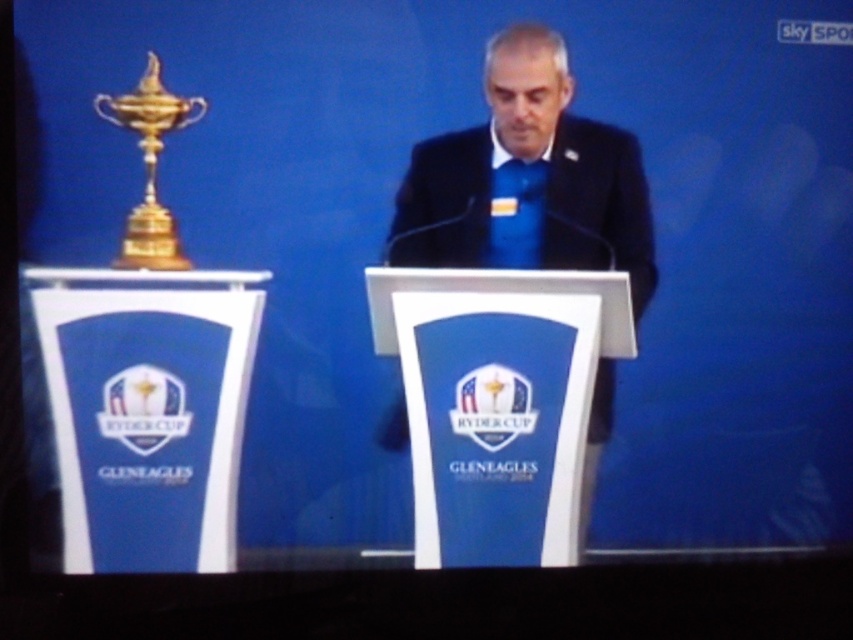
Question: Among these points, which one is nearest to the camera?

Choices:
 (A) coord(578,218)
 (B) coord(146,224)

Answer: (B)

Question: Which point is farther to the camera?

Choices:
 (A) (480, 252)
 (B) (177, 109)

Answer: (A)

Question: Can you confirm if blue satin suit at center is smaller than gold polished metal trophy at left?

Choices:
 (A) no
 (B) yes

Answer: (A)

Question: Observing the image, what is the correct spatial positioning of blue satin suit at center in reference to gold polished metal trophy at left?

Choices:
 (A) left
 (B) right

Answer: (B)

Question: Does blue satin suit at center come in front of gold polished metal trophy at left?

Choices:
 (A) no
 (B) yes

Answer: (A)